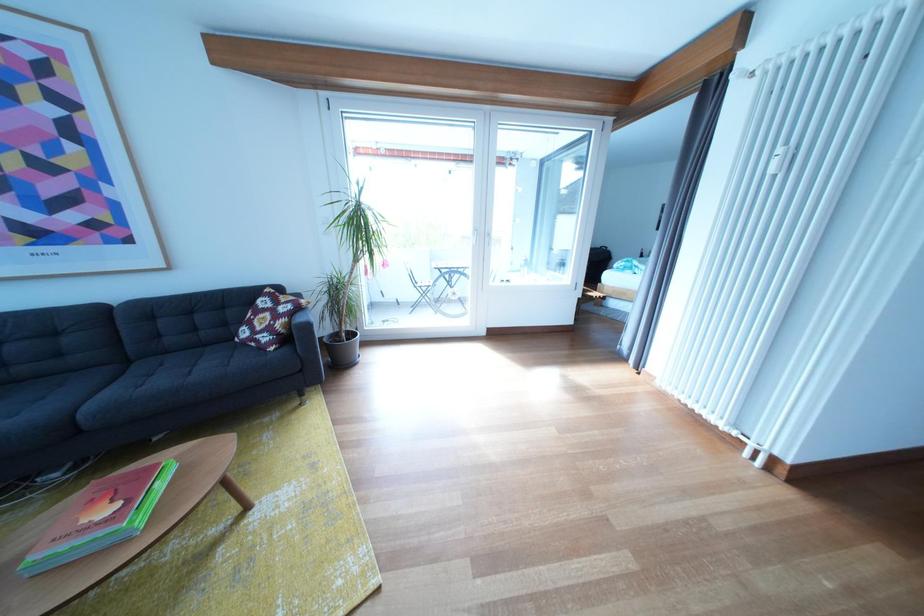
Where would you rest the dark grey sofa armrest? Please return your answer as a coordinate pair (x, y).

(306, 336)